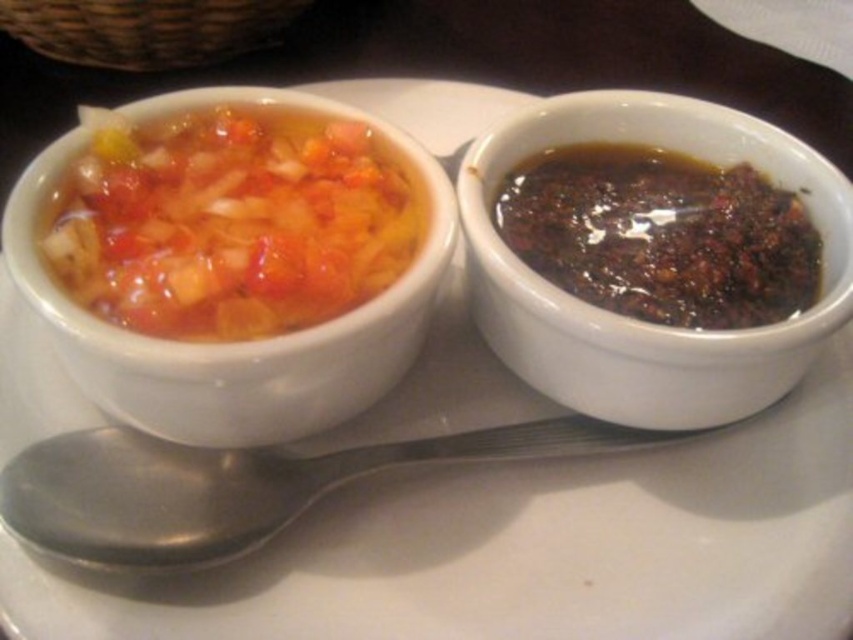
In the scene shown: You have a silver metallic spoon at lower left and want to reach the dark glossy sauce at right. Considering the distance between them, can you estimate if you can comfortably reach the sauce with the spoon without moving your hand?

The distance between the dark glossy sauce at right and the silver metallic spoon at lower left is 8.90 inches. Since this distance is within a typical comfortable reaching range for most people, you can comfortably reach the sauce with the spoon without moving your hand.

You are a food stylist arranging items on a table. There is a matte ceramic bowl at upper left. Where exactly should you place it to match the image?

The matte ceramic bowl at upper left should be placed at point (241, 342) to match the image.